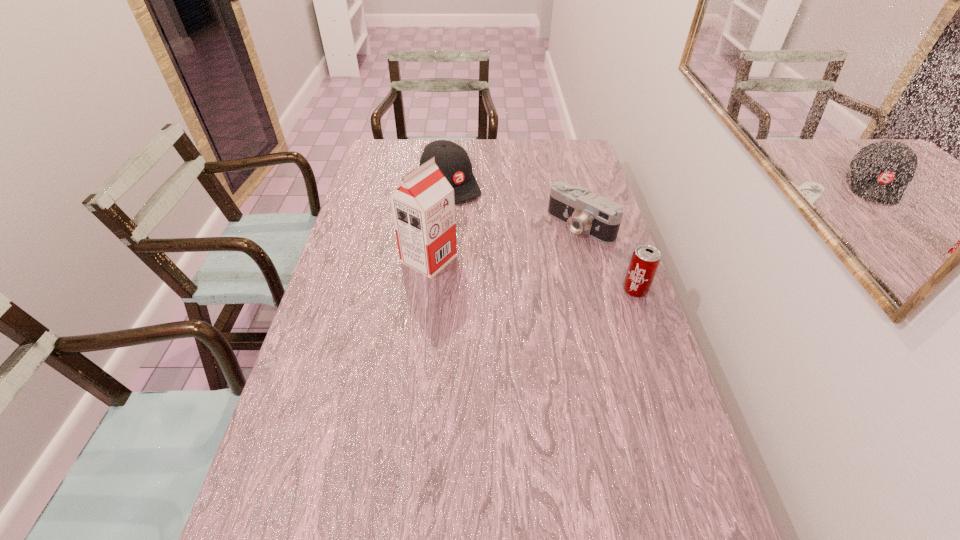
Find the location of `free space that satisfies the following two spatial constraints: 1. on the back side of the baseball cap; 2. on the left side of the tallest object`. free space that satisfies the following two spatial constraints: 1. on the back side of the baseball cap; 2. on the left side of the tallest object is located at coordinates (438, 184).

Locate an element on the screen. vacant area that satisfies the following two spatial constraints: 1. on the back side of the soya milk; 2. on the right side of the shortest object is located at coordinates pyautogui.click(x=433, y=225).

Where is `vacant space that satisfies the following two spatial constraints: 1. on the front side of the camera; 2. on the right side of the nearest object`? Image resolution: width=960 pixels, height=540 pixels. vacant space that satisfies the following two spatial constraints: 1. on the front side of the camera; 2. on the right side of the nearest object is located at coordinates (597, 290).